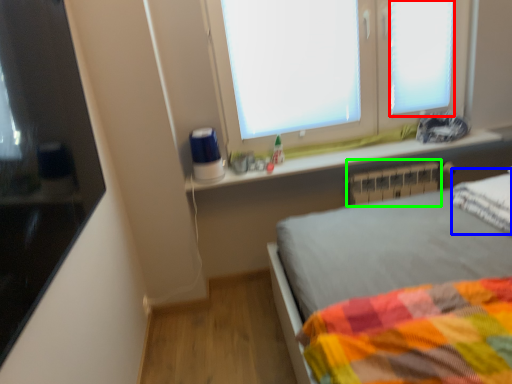
Question: Based on their relative distances, which object is farther from window frame (highlighted by a red box)? Choose from pillow (highlighted by a blue box) and radiator (highlighted by a green box).

Choices:
 (A) pillow
 (B) radiator

Answer: (A)